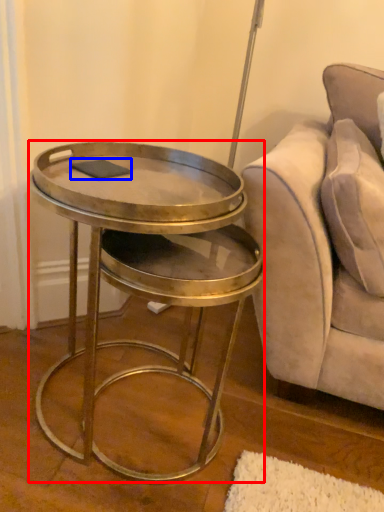
Question: Which object is further to the camera taking this photo, table (highlighted by a red box) or pad (highlighted by a blue box)?

Choices:
 (A) table
 (B) pad

Answer: (B)